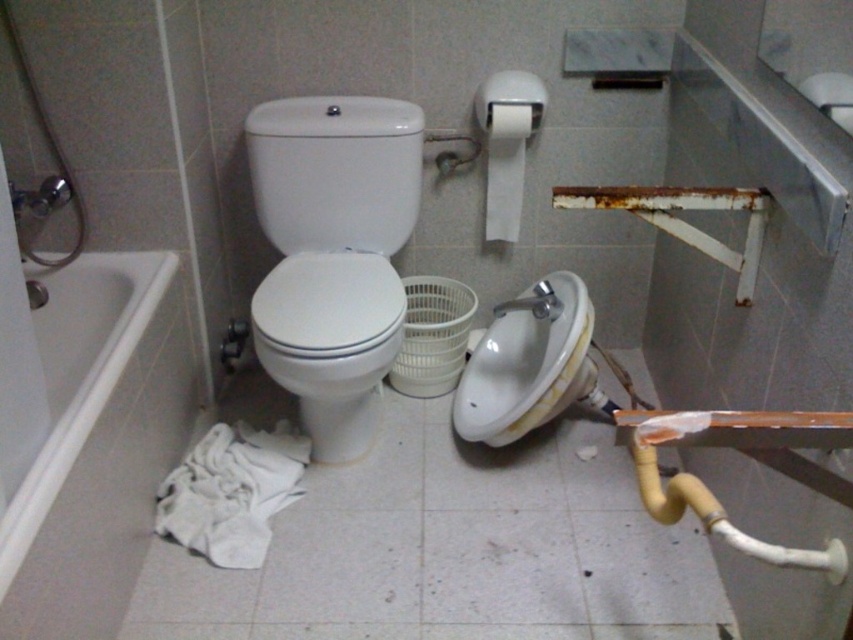
Does white glossy toilet at center have a lesser width compared to white matte toilet paper at upper center?

In fact, white glossy toilet at center might be wider than white matte toilet paper at upper center.

Which is behind, point (392, 236) or point (515, 198)?

Point (515, 198)

I want to click on white glossy toilet at center, so click(x=334, y=253).

In the scene shown: Can you confirm if white glossy toilet at center is wider than white glossy sink at center?

Answer: Yes, white glossy toilet at center is wider than white glossy sink at center.

The height and width of the screenshot is (640, 853). I want to click on white glossy toilet at center, so click(334, 253).

Does point (345, 435) come farther from viewer compared to point (531, 365)?

No, it is not.

The height and width of the screenshot is (640, 853). Identify the location of white glossy toilet at center. (334, 253).

Does point (91, 474) come in front of point (527, 326)?

Yes, point (91, 474) is in front of point (527, 326).

Consider the image. Is white glossy bathtub at lower left positioned before white glossy sink at center?

Yes, it is.

Is point (148, 416) positioned after point (482, 364)?

No, it is not.

Locate an element on the screen. Image resolution: width=853 pixels, height=640 pixels. white glossy bathtub at lower left is located at coordinates (97, 444).